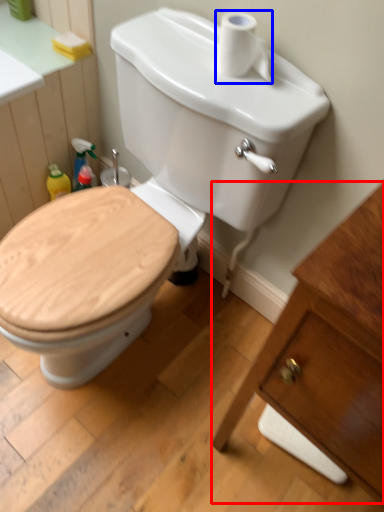
Question: Which of the following is the farthest to the observer, porcelain (highlighted by a red box) or toilet paper (highlighted by a blue box)?

Choices:
 (A) porcelain
 (B) toilet paper

Answer: (B)